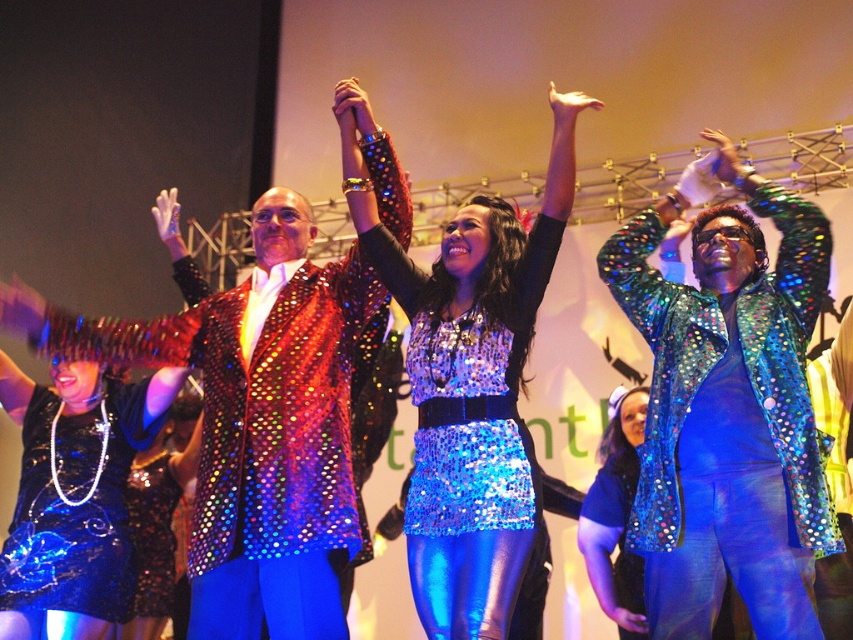
Question: Can you confirm if holographic sequin jacket at upper right is positioned to the left of shiny sequin dress at center?

Choices:
 (A) no
 (B) yes

Answer: (A)

Question: Which of the following is the closest to the observer?

Choices:
 (A) holographic sequin jacket at upper right
 (B) shiny sequined jacket at center
 (C) shiny sequin dress at center

Answer: (C)

Question: Which object is farther from the camera taking this photo?

Choices:
 (A) shiny sequin dress at center
 (B) holographic sequin jacket at upper right
 (C) matte gold hand at upper center

Answer: (B)

Question: Can you confirm if holographic sequin jacket at upper right is positioned below blue sequined dress at center?

Choices:
 (A) yes
 (B) no

Answer: (B)

Question: Where is shiny sequin dress at center located in relation to blue sequined dress at center in the image?

Choices:
 (A) right
 (B) left

Answer: (B)

Question: Among these objects, which one is farthest from the camera?

Choices:
 (A) shiny sequined jacket at center
 (B) holographic sequin jacket at upper right
 (C) matte gold hand at upper center
 (D) blue sequined dress at center

Answer: (D)